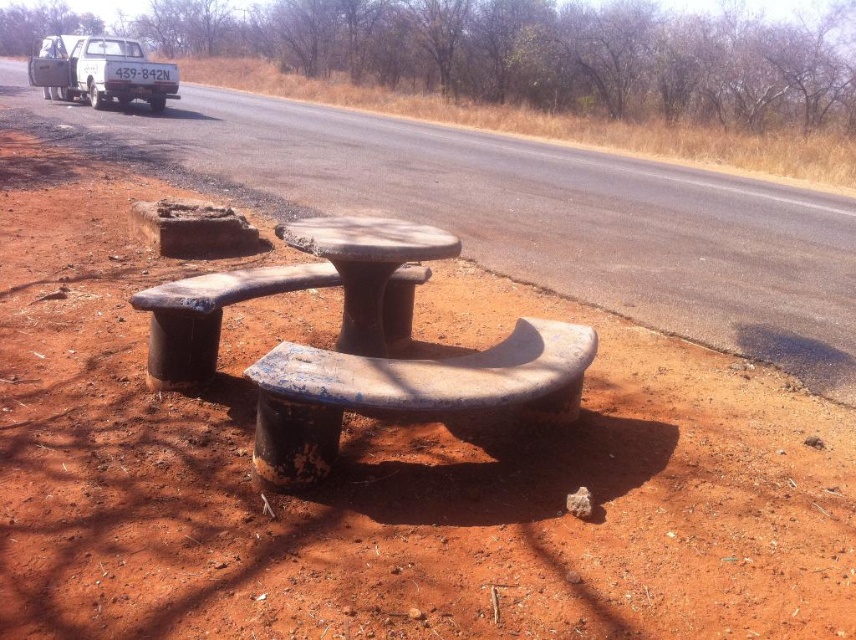
Question: Which of these objects is positioned closest to the rusty concrete table at center?

Choices:
 (A) blue painted wood bench at center
 (B) white matte truck at upper left

Answer: (A)

Question: Which point is farther to the camera?

Choices:
 (A) blue painted wood bench at center
 (B) rusty concrete table at center

Answer: (B)

Question: Which point is closer to the camera?

Choices:
 (A) (379, 304)
 (B) (574, 368)

Answer: (B)

Question: Does blue painted wood bench at center have a greater width compared to rusty wood bench at center?

Choices:
 (A) no
 (B) yes

Answer: (B)

Question: Is blue painted wood bench at center to the left of rusty concrete table at center from the viewer's perspective?

Choices:
 (A) no
 (B) yes

Answer: (A)

Question: Does blue painted wood bench at center appear on the left side of rusty concrete table at center?

Choices:
 (A) yes
 (B) no

Answer: (B)